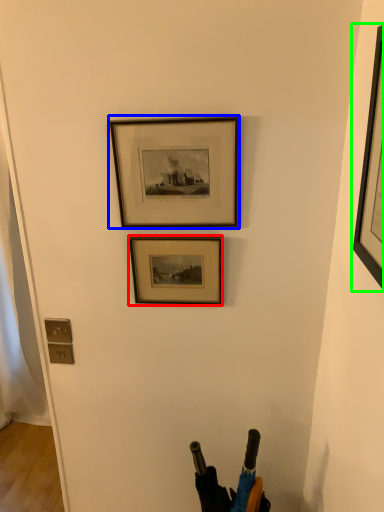
Question: Which is farther away from picture frame (highlighted by a red box)? picture frame (highlighted by a blue box) or picture frame (highlighted by a green box)?

Choices:
 (A) picture frame
 (B) picture frame

Answer: (B)